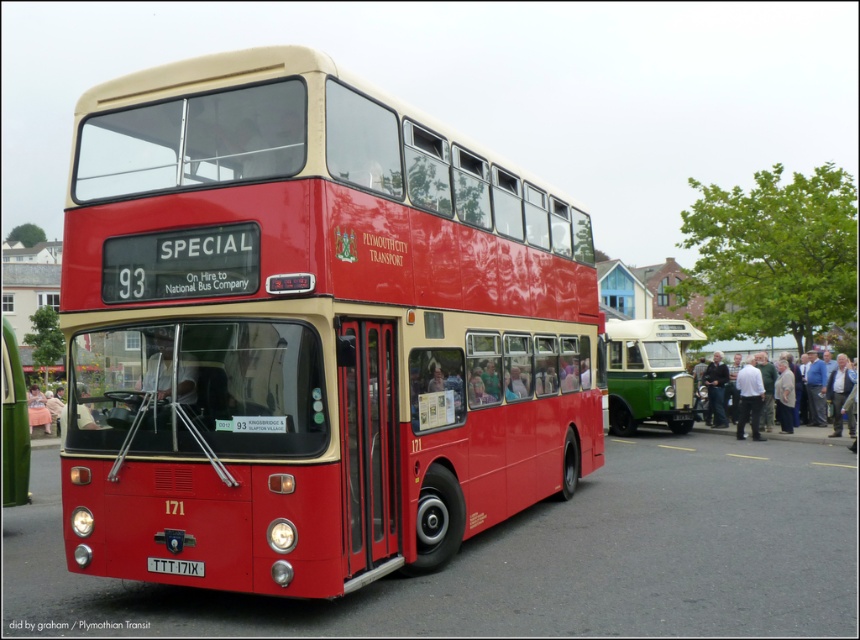
Question: Estimate the real-world distances between objects in this image. Which object is farther from the matte red bus at center?

Choices:
 (A) green polished wood bus at center
 (B) red plastic license plate at center

Answer: (A)

Question: Does matte red bus at center appear under green polished wood bus at center?

Choices:
 (A) yes
 (B) no

Answer: (B)

Question: Does matte red bus at center appear over red plastic license plate at center?

Choices:
 (A) no
 (B) yes

Answer: (B)

Question: Which object appears farthest from the camera in this image?

Choices:
 (A) green polished wood bus at center
 (B) red plastic license plate at center
 (C) matte red bus at center

Answer: (A)

Question: Which point is farther from the camera taking this photo?

Choices:
 (A) (637, 397)
 (B) (148, 561)
 (C) (185, 433)

Answer: (A)

Question: Can you confirm if matte red bus at center is bigger than green polished wood bus at center?

Choices:
 (A) no
 (B) yes

Answer: (A)